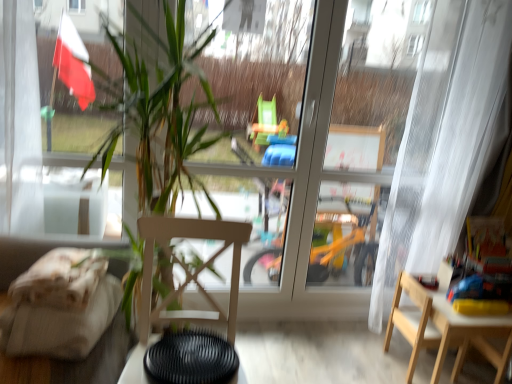
Question: Is point (407, 334) positioned closer to the camera than point (424, 59)?

Choices:
 (A) closer
 (B) farther

Answer: (B)

Question: Considering the positions of light wood chair at lower right, the 1th chair positioned from the back, and white sheer curtain at right in the image, is light wood chair at lower right, the 1th chair positioned from the back, taller or shorter than white sheer curtain at right?

Choices:
 (A) short
 (B) tall

Answer: (A)

Question: Which object is positioned farthest from the green leafy plant at center?

Choices:
 (A) light wood chair at lower right, the 1th chair when ordered from right to left
 (B) beige fabric couch at left
 (C) wooden chair at center, placed as the second chair when sorted from back to front
 (D) wooden table at lower right, placed as the first table when sorted from back to front
 (E) black matte table at lower center, positioned as the first table in front-to-back order

Answer: (D)

Question: Which object is the farthest from the white sheer curtain at right?

Choices:
 (A) green leafy plant at center
 (B) wooden table at lower right, which appears as the second table when viewed from the left
 (C) black matte table at lower center, which is counted as the second table, starting from the back
 (D) light wood chair at lower right, the 1th chair when ordered from right to left
 (E) beige fabric couch at left

Answer: (E)